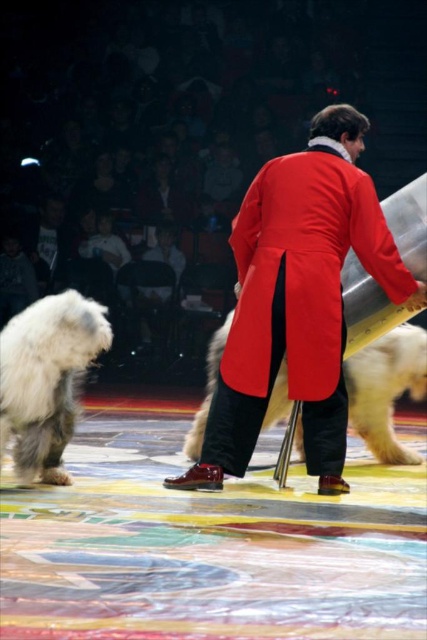
You are a photographer standing at the back of the circus stage. You want to take a photo of both the shiny red coat at center and the white fluffy dog at center. Since you can only focus on one subject at a time, which one should you choose to ensure the other is still visible in the background?

The shiny red coat at center is much taller than the white fluffy dog at center, so if you focus on the shiny red coat at center, the white fluffy dog at center will still be visible in the background. Alternatively, focusing on the white fluffy dog at center might risk the taller shiny red coat at center blocking it partially.

You are a stagehand trying to place a new spotlight at position point 0.5, 0.7. Will the shiny red coat at center be directly under the spotlight?

The shiny red coat at center is located at point (298, 300), which is very close to the desired spotlight position of (298, 320). Since the coordinates are nearly identical, the coat will be directly under the spotlight.